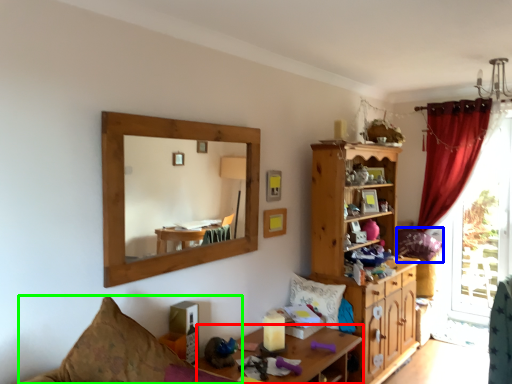
Question: Which object is the farthest from desk (highlighted by a red box)? Choose among these: pillow (highlighted by a blue box) or couch (highlighted by a green box).

Choices:
 (A) pillow
 (B) couch

Answer: (A)